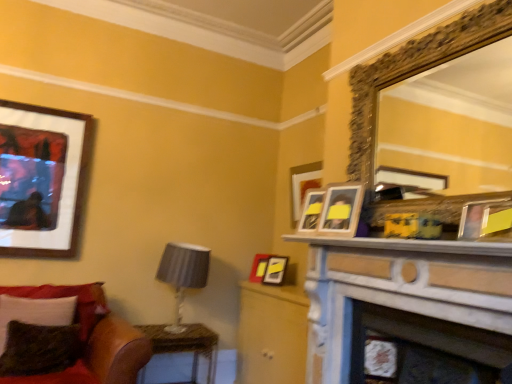
Question: Considering their positions, is matte yellow picture frame at upper right, which is counted as the fifth picture frame, starting from the left, located in front of or behind gold ornate mirror at upper right?

Choices:
 (A) behind
 (B) front

Answer: (B)

Question: Which is correct: matte yellow picture frame at upper right, which is counted as the fifth picture frame, starting from the left, is inside gold ornate mirror at upper right, or outside of it?

Choices:
 (A) outside
 (B) inside

Answer: (A)

Question: Which object is the closest to the velvet red couch at lower left?

Choices:
 (A) wooden photo frame at upper right, placed as the second picture frame when sorted from right to left
 (B) matte black picture frame at center, which is the 2th picture frame in left-to-right order
 (C) gold ornate mirror at upper right
 (D) wooden table at lower left
 (E) matte black frame at upper left, acting as the 3th picture frame starting from the back

Answer: (D)

Question: Which object is the farthest from the gold ornate mirror at upper right?

Choices:
 (A) satin gray lampshade at lower left
 (B) wooden photo frame at upper right, which ranks as the 2th picture frame in front-to-back order
 (C) wooden table at lower left
 (D) velvet green pillow at lower left, the first pillow positioned from the front
 (E) velvety green pillow at lower left, positioned as the 1th pillow in back-to-front order

Answer: (E)